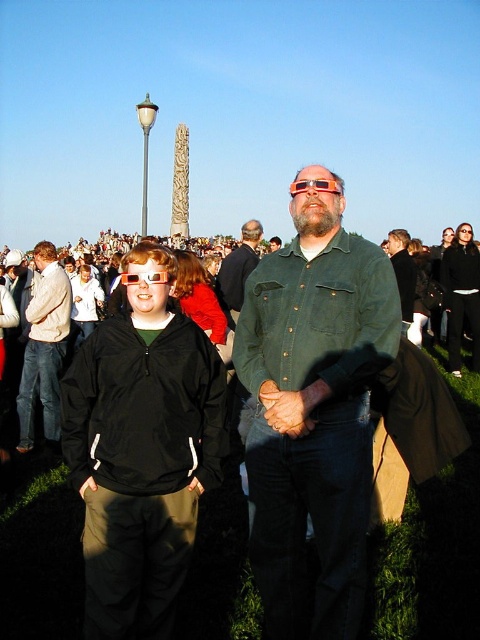
You are at an outdoor event and want to take a photo of the translucent orange goggles at center without the matte black jacket at left blocking the view. Is this possible given their positions?

The translucent orange goggles at center is behind the matte black jacket at left, so you cannot take a photo of the translucent orange goggles at center without the matte black jacket at left blocking the view.

You are at an outdoor event and want to take a photo of the matte black jacket at center and the translucent orange goggles at center. Which object should you focus on first if you want to capture both in focus without moving the camera?

The matte black jacket at center is below translucent orange goggles at center, so you should focus on the translucent orange goggles at center first since it is farther away, ensuring both are in focus with a single focal point.

You are standing in the outdoor event area and see the matte black jacket at left and the translucent orange goggles at center. Which object is positioned lower in the image?

The matte black jacket at left is positioned below the translucent orange goggles at center, so it is lower in the image.